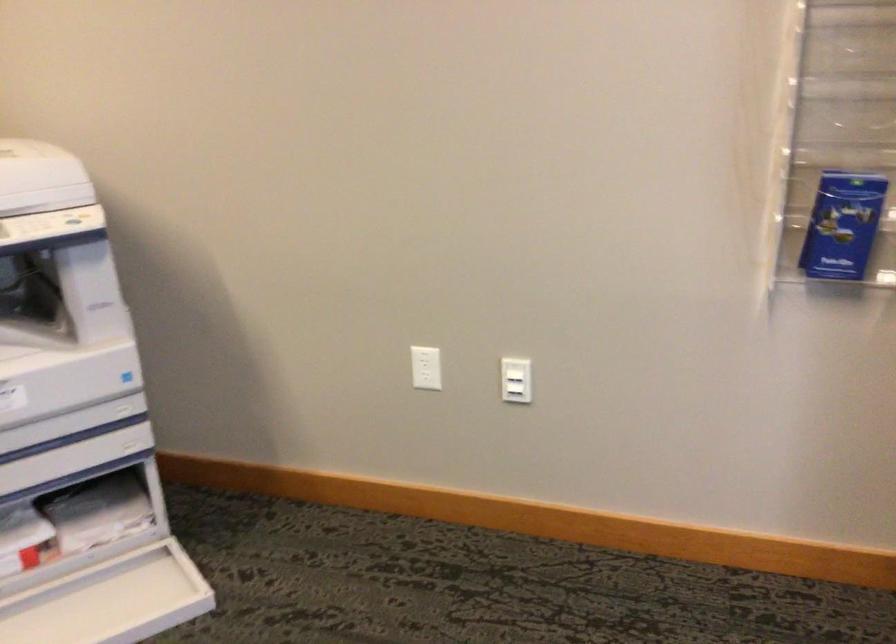
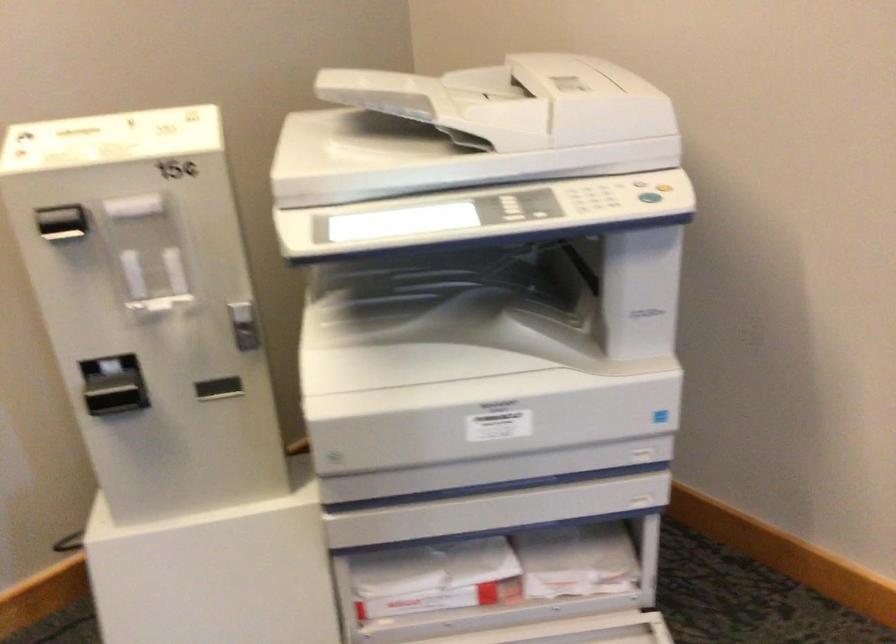
In a continuous first-person perspective shot, in which direction is the camera moving?

The movement direction of the cameraman is left, forward.